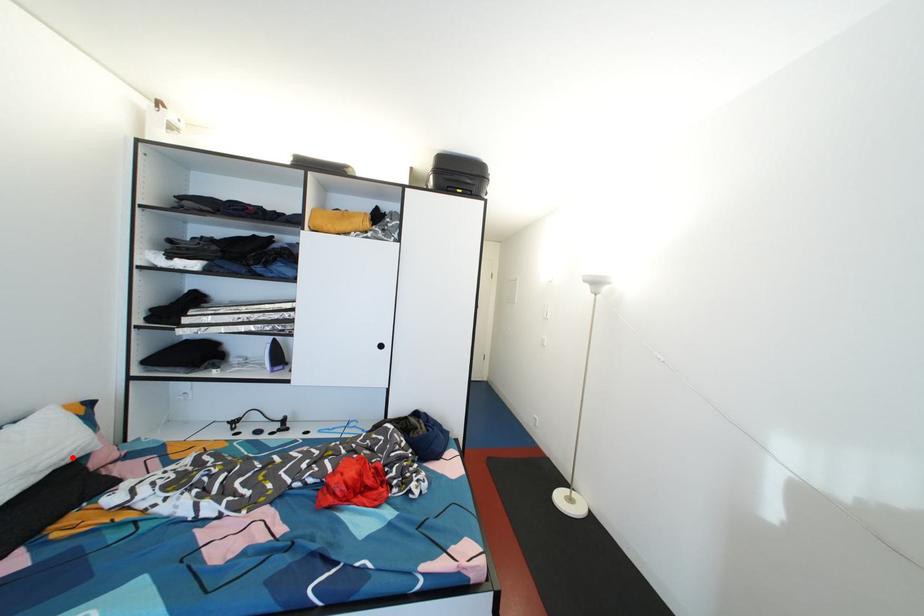
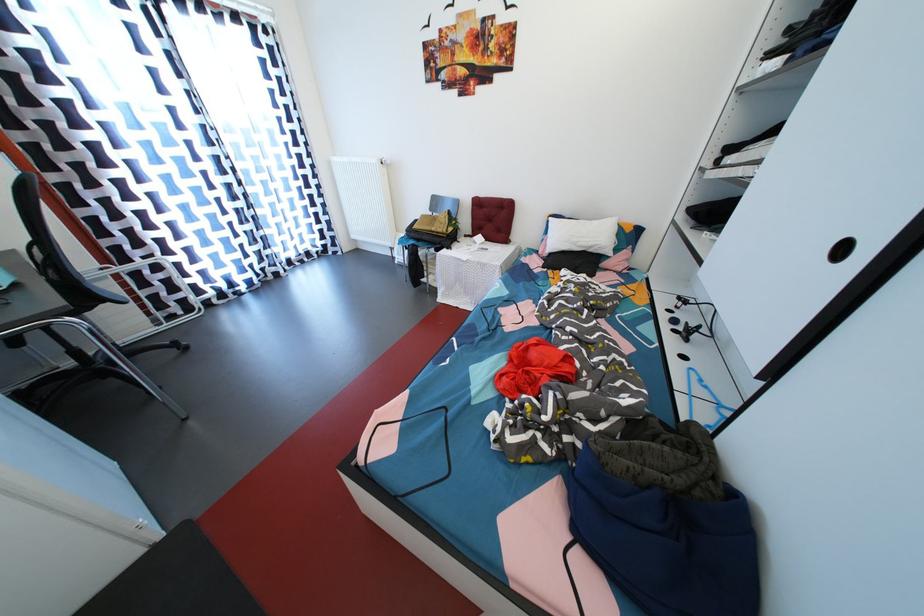
Question: I am providing you with two images of the same scene from different viewpoints. In image1, a red point is highlighted. Considering the same 3D point in image2, which of the following is correct?

Choices:
 (A) It is closer
 (B) It is farther

Answer: (A)